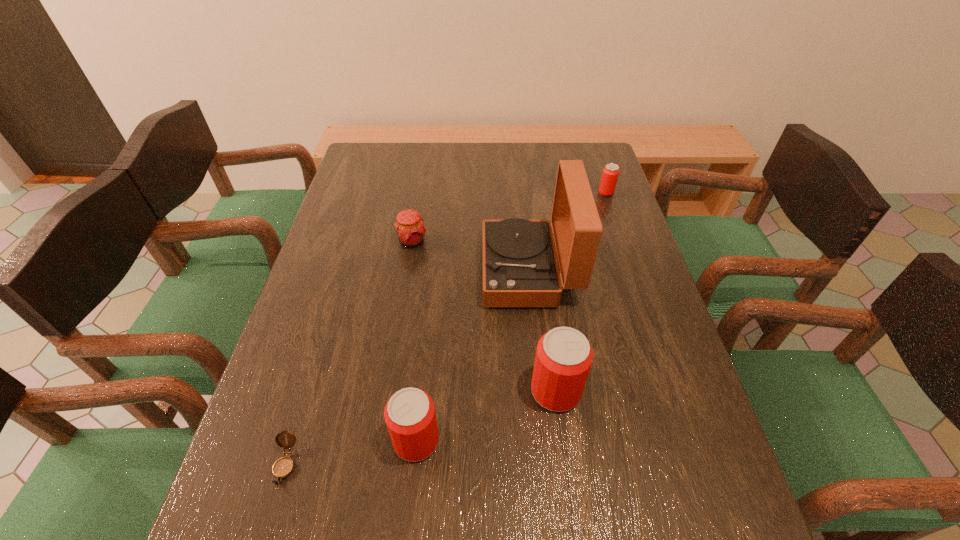
This screenshot has height=540, width=960. I want to click on unoccupied position between the jam and the shortest beer can, so click(509, 218).

Find the location of a particular element. Image resolution: width=960 pixels, height=540 pixels. vacant space in between the phonograph record and the shortest object is located at coordinates point(407,368).

In order to click on vacant space that's between the rightmost object and the fourth shortest object in this screenshot , I will do click(511, 317).

At what (x,y) coordinates should I click in order to perform the action: click on vacant area between the farthest beer can and the leftmost object. Please return your answer as a coordinate pair (x, y). The width and height of the screenshot is (960, 540). Looking at the image, I should click on (445, 329).

Locate an element on the screen. The height and width of the screenshot is (540, 960). empty space that is in between the fourth farthest object and the phonograph record is located at coordinates (542, 330).

Identify the location of vacant region between the nearest beer can and the shortest beer can. (511, 317).

Locate an element on the screen. The width and height of the screenshot is (960, 540). object that is the closest to the second farthest beer can is located at coordinates (519, 263).

Where is `object identified as the third closest to the compass`? The image size is (960, 540). object identified as the third closest to the compass is located at coordinates (519, 263).

Select which beer can appears as the second closest to the jam. Please provide its 2D coordinates. Your answer should be formatted as a tuple, i.e. [(x, y)], where the tuple contains the x and y coordinates of a point satisfying the conditions above.

[(410, 416)]

This screenshot has width=960, height=540. Identify the location of beer can that is the second nearest to the shortest beer can. (410, 416).